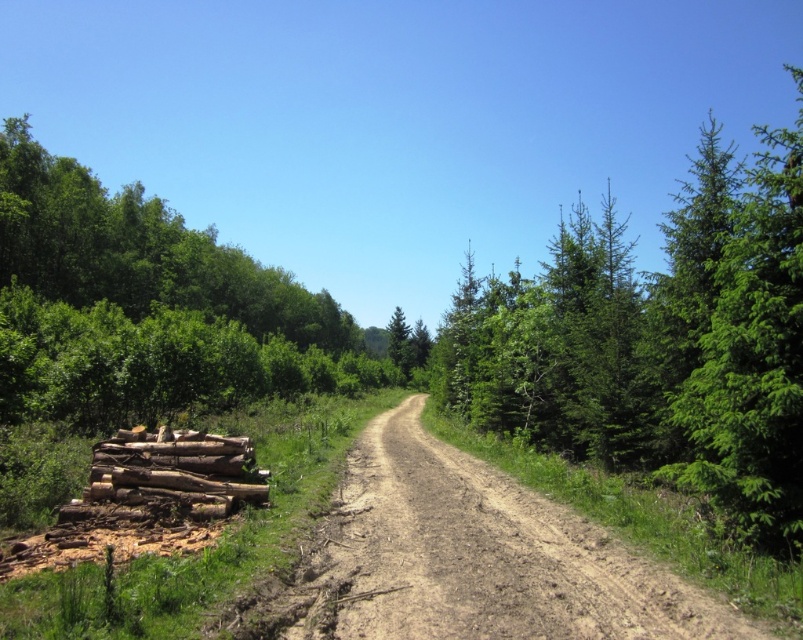
Is point (602, 340) behind point (261, 497)?

Yes, point (602, 340) is behind point (261, 497).

Does point (618, 435) come closer to viewer compared to point (162, 444)?

No, it is not.

This screenshot has height=640, width=803. Find the location of `green needle-like trees at right`. green needle-like trees at right is located at coordinates (658, 342).